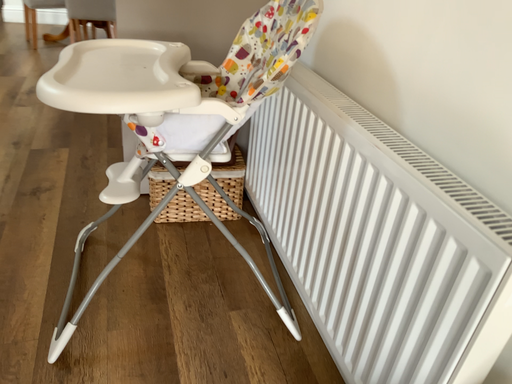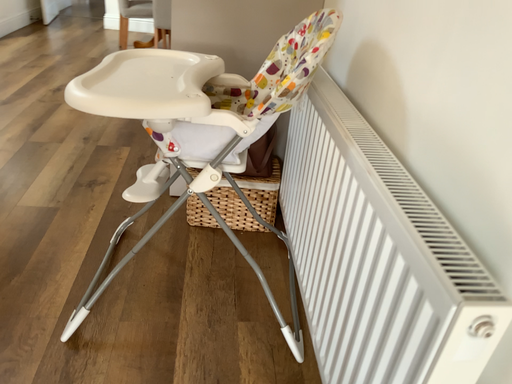
Question: How did the camera likely rotate when shooting the video?

Choices:
 (A) rotated left
 (B) rotated right

Answer: (A)